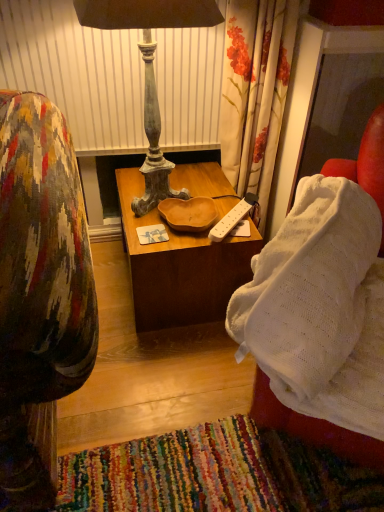
The height and width of the screenshot is (512, 384). What are the coordinates of `free location above wooden table at center (from a real-world perspective)` in the screenshot? It's located at (196, 194).